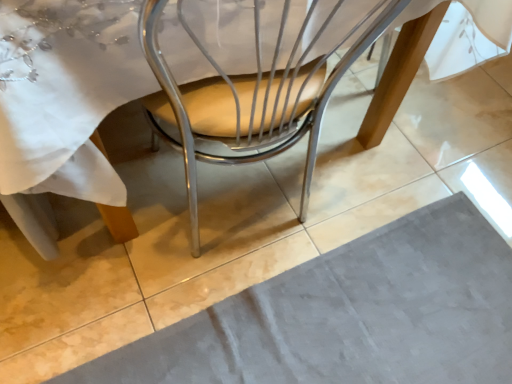
I want to click on gray velvety place mat at lower center, so click(x=350, y=315).

The width and height of the screenshot is (512, 384). What do you see at coordinates (350, 315) in the screenshot?
I see `gray velvety place mat at lower center` at bounding box center [350, 315].

What is the approximate width of gray velvety place mat at lower center?

4.05 feet.

The height and width of the screenshot is (384, 512). Describe the element at coordinates (251, 96) in the screenshot. I see `metallic tan chair at center` at that location.

What are the coordinates of `metallic tan chair at center` in the screenshot? It's located at (251, 96).

This screenshot has height=384, width=512. I want to click on gray velvety place mat at lower center, so click(x=350, y=315).

Considering the positions of objects metallic tan chair at center and gray velvety place mat at lower center in the image provided, who is more to the left, metallic tan chair at center or gray velvety place mat at lower center?

From the viewer's perspective, metallic tan chair at center appears more on the left side.

Between metallic tan chair at center and gray velvety place mat at lower center, which one is positioned behind?

gray velvety place mat at lower center is more distant.

Is point (237, 114) positioned behind point (149, 341)?

That is False.

From the image's perspective, is metallic tan chair at center positioned above or below gray velvety place mat at lower center?

Based on their image positions, metallic tan chair at center is located above gray velvety place mat at lower center.

From a real-world perspective, is metallic tan chair at center under gray velvety place mat at lower center?

Incorrect, from a real-world perspective, metallic tan chair at center is higher than gray velvety place mat at lower center.

Does metallic tan chair at center have a greater width compared to gray velvety place mat at lower center?

Incorrect, the width of metallic tan chair at center does not surpass that of gray velvety place mat at lower center.

Considering the relative sizes of metallic tan chair at center and gray velvety place mat at lower center in the image provided, is metallic tan chair at center shorter than gray velvety place mat at lower center?

No, metallic tan chair at center is not shorter than gray velvety place mat at lower center.

Considering the relative sizes of metallic tan chair at center and gray velvety place mat at lower center in the image provided, is metallic tan chair at center smaller than gray velvety place mat at lower center?

No, metallic tan chair at center is not smaller than gray velvety place mat at lower center.

Looking at this image, is gray velvety place mat at lower center a part of metallic tan chair at center?

No, metallic tan chair at center does not contain gray velvety place mat at lower center.

Are metallic tan chair at center and gray velvety place mat at lower center far apart?

Actually, metallic tan chair at center and gray velvety place mat at lower center are a little close together.

Is metallic tan chair at center aimed at gray velvety place mat at lower center?

Yes.

How distant is metallic tan chair at center from gray velvety place mat at lower center?

A distance of 16.08 inches exists between metallic tan chair at center and gray velvety place mat at lower center.

Where is `chair in front of the gray velvety place mat at lower center`? The image size is (512, 384). chair in front of the gray velvety place mat at lower center is located at coordinates (251, 96).

Can you confirm if gray velvety place mat at lower center is positioned to the left of metallic tan chair at center?

Incorrect, gray velvety place mat at lower center is not on the left side of metallic tan chair at center.

Considering their positions, is gray velvety place mat at lower center located in front of or behind metallic tan chair at center?

gray velvety place mat at lower center is behind metallic tan chair at center.

Is point (315, 320) closer to camera compared to point (178, 95)?

That is False.

From the image's perspective, does gray velvety place mat at lower center appear lower than metallic tan chair at center?

Indeed, from the image's perspective, gray velvety place mat at lower center is shown beneath metallic tan chair at center.

From a real-world perspective, which object rests below the other?

gray velvety place mat at lower center, from a real-world perspective.

Is gray velvety place mat at lower center thinner than metallic tan chair at center?

In fact, gray velvety place mat at lower center might be wider than metallic tan chair at center.

Does gray velvety place mat at lower center have a lesser height compared to metallic tan chair at center?

Yes.

Who is smaller, gray velvety place mat at lower center or metallic tan chair at center?

gray velvety place mat at lower center.

Is gray velvety place mat at lower center located outside metallic tan chair at center?

Yes.

Can you see gray velvety place mat at lower center touching metallic tan chair at center?

No, gray velvety place mat at lower center is not with metallic tan chair at center.

Is metallic tan chair at center at the back of gray velvety place mat at lower center?

No, metallic tan chair at center is not at the back of gray velvety place mat at lower center.

Can you tell me how much gray velvety place mat at lower center and metallic tan chair at center differ in facing direction?

90.2 degrees separate the facing orientations of gray velvety place mat at lower center and metallic tan chair at center.

Find the location of `place mat lying behind the metallic tan chair at center`. place mat lying behind the metallic tan chair at center is located at coordinates (350, 315).

Image resolution: width=512 pixels, height=384 pixels. I want to click on chair above the gray velvety place mat at lower center (from the image's perspective), so click(x=251, y=96).

This screenshot has height=384, width=512. What are the coordinates of `place mat below the metallic tan chair at center (from a real-world perspective)` in the screenshot? It's located at (350, 315).